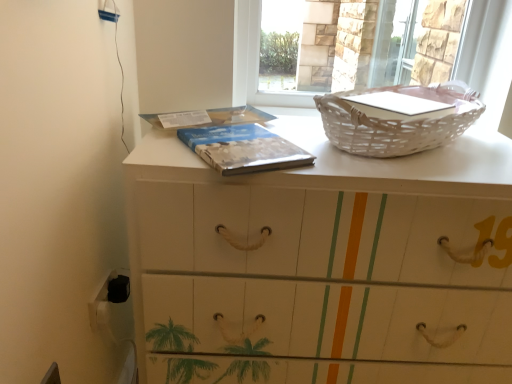
Image resolution: width=512 pixels, height=384 pixels. What do you see at coordinates (392, 42) in the screenshot?
I see `transparent glass screen door at upper center` at bounding box center [392, 42].

The image size is (512, 384). What do you see at coordinates (397, 122) in the screenshot?
I see `white wicker basket at upper right` at bounding box center [397, 122].

What do you see at coordinates (245, 50) in the screenshot? The image size is (512, 384). I see `white wicker basket at upper right` at bounding box center [245, 50].

Locate an element on the screen. This screenshot has height=384, width=512. transparent glass screen door at upper center is located at coordinates (392, 42).

Does transparent glass screen door at upper center have a greater width compared to blue textured book at center?

In fact, transparent glass screen door at upper center might be narrower than blue textured book at center.

Are transparent glass screen door at upper center and blue textured book at center far apart?

Absolutely, transparent glass screen door at upper center is distant from blue textured book at center.

What's the angular difference between transparent glass screen door at upper center and blue textured book at center's facing directions?

They differ by 56.2 degrees in their facing directions.

From a real-world perspective, relative to blue textured book at center, is transparent glass screen door at upper center vertically above or below?

Clearly, from a real-world perspective, transparent glass screen door at upper center is above blue textured book at center.

Based on the photo, measure the distance between blue textured book at center and white wicker basket at upper right.

The distance of blue textured book at center from white wicker basket at upper right is 21.18 inches.

Considering the relative sizes of blue textured book at center and white wicker basket at upper right in the image provided, is blue textured book at center shorter than white wicker basket at upper right?

Yes.

Is blue textured book at center at the right side of white wicker basket at upper right?

Incorrect, blue textured book at center is not on the right side of white wicker basket at upper right.

Identify the location of window on the right of blue textured book at center. The image size is (512, 384). (245, 50).

Considering the sizes of white wicker basket at upper right and blue textured book at center in the image, is white wicker basket at upper right wider or thinner than blue textured book at center?

Considering their sizes, white wicker basket at upper right looks slimmer than blue textured book at center.

Is white wicker basket at upper right positioned in front of blue textured book at center?

No, white wicker basket at upper right is behind blue textured book at center.

I want to click on window behind the blue textured book at center, so click(245, 50).

Which is more to the left, white wicker basket at upper right or blue textured book at center?

From the viewer's perspective, blue textured book at center appears more on the left side.

Consider the image. What's the angular difference between white painted wood chest of drawers at center and white wicker basket at upper right's facing directions?

The angular difference between white painted wood chest of drawers at center and white wicker basket at upper right is 0.000299 degrees.

Looking at the image, does white painted wood chest of drawers at center seem bigger or smaller compared to white wicker basket at upper right?

Clearly, white painted wood chest of drawers at center is larger in size than white wicker basket at upper right.

From a real-world perspective, is white painted wood chest of drawers at center over white wicker basket at upper right?

No, from a real-world perspective, white painted wood chest of drawers at center is not on top of white wicker basket at upper right.

Considering the sizes of objects white wicker basket at upper right and blue textured book at center in the image provided, who is wider, white wicker basket at upper right or blue textured book at center?

white wicker basket at upper right is wider.

Which is in front, point (432, 132) or point (301, 161)?

The point (301, 161) is in front.

Which object is closer to the camera taking this photo, white wicker basket at upper right or blue textured book at center?

Positioned in front is blue textured book at center.

From the image's perspective, is white wicker basket at upper right positioned above or below blue textured book at center?

white wicker basket at upper right is situated higher than blue textured book at center in the image.

Is white wicker basket at upper right bigger or smaller than white painted wood chest of drawers at center?

Considering their sizes, white wicker basket at upper right takes up less space than white painted wood chest of drawers at center.

Could you tell me if white wicker basket at upper right is turned towards white painted wood chest of drawers at center?

No.

From a real-world perspective, is white wicker basket at upper right positioned above or below white painted wood chest of drawers at center?

white wicker basket at upper right is above white painted wood chest of drawers at center.

Is white wicker basket at upper right shorter than white painted wood chest of drawers at center?

Yes.

Is white wicker basket at upper right facing towards transparent glass screen door at upper center?

No.

Is white wicker basket at upper right next to transparent glass screen door at upper center and touching it?

white wicker basket at upper right is not next to transparent glass screen door at upper center, and they're not touching.

From a real-world perspective, is white wicker basket at upper right above or below transparent glass screen door at upper center?

In terms of real-world spatial position, white wicker basket at upper right is below transparent glass screen door at upper center.

This screenshot has width=512, height=384. In order to click on paperback book on the left of transparent glass screen door at upper center in this screenshot , I will do `click(243, 149)`.

The height and width of the screenshot is (384, 512). I want to click on paperback book below the white wicker basket at upper right (from the image's perspective), so click(x=243, y=149).

Looking at the image, which one is located further to transparent glass screen door at upper center, white wicker basket at upper right or white wicker basket at upper right?

Based on the image, white wicker basket at upper right appears to be further to transparent glass screen door at upper center.

Based on their spatial positions, is transparent glass screen door at upper center or white painted wood chest of drawers at center closer to white wicker basket at upper right?

white painted wood chest of drawers at center is closer to white wicker basket at upper right.

When comparing their distances from white wicker basket at upper right, does white wicker basket at upper right or transparent glass screen door at upper center seem closer?

white wicker basket at upper right lies closer to white wicker basket at upper right than the other object.

Looking at the image, which one is located further to white wicker basket at upper right, white wicker basket at upper right or blue textured book at center?

white wicker basket at upper right lies further to white wicker basket at upper right than the other object.

When comparing their distances from white wicker basket at upper right, does blue textured book at center or white wicker basket at upper right seem further?

Based on the image, blue textured book at center appears to be further to white wicker basket at upper right.

Considering their positions, is white painted wood chest of drawers at center positioned closer to white wicker basket at upper right than transparent glass screen door at upper center?

Based on the image, white painted wood chest of drawers at center appears to be nearer to white wicker basket at upper right.

From the image, which object appears to be farther from white painted wood chest of drawers at center, white wicker basket at upper right or blue textured book at center?

Among the two, white wicker basket at upper right is located further to white painted wood chest of drawers at center.

Estimate the real-world distances between objects in this image. Which object is closer to transparent glass screen door at upper center, blue textured book at center or white painted wood chest of drawers at center?

white painted wood chest of drawers at center.

Find the location of a particular element. This screenshot has height=384, width=512. basket container between white wicker basket at upper right and white painted wood chest of drawers at center in the vertical direction is located at coordinates (397, 122).

Image resolution: width=512 pixels, height=384 pixels. Find the location of `basket container between white painted wood chest of drawers at center and transparent glass screen door at upper center along the z-axis`. basket container between white painted wood chest of drawers at center and transparent glass screen door at upper center along the z-axis is located at coordinates (397, 122).

Find the location of a particular element. This screenshot has width=512, height=384. window located between white wicker basket at upper right and transparent glass screen door at upper center in the depth direction is located at coordinates (245, 50).

Where is `basket container between blue textured book at center and white wicker basket at upper right along the z-axis`? basket container between blue textured book at center and white wicker basket at upper right along the z-axis is located at coordinates (397, 122).